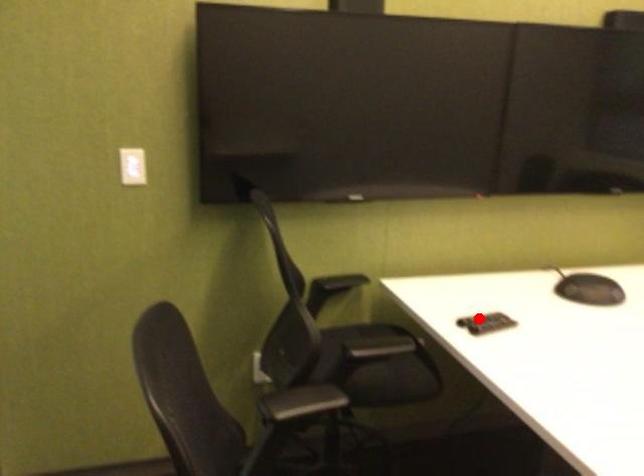
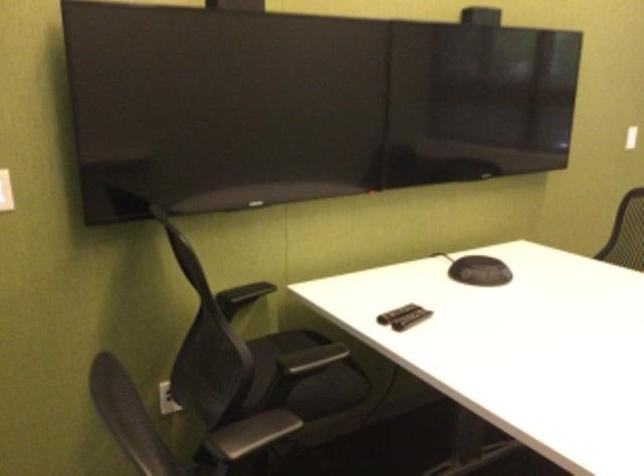
In the second image, find the point that corresponds to the highlighted location in the first image.

(395, 313)